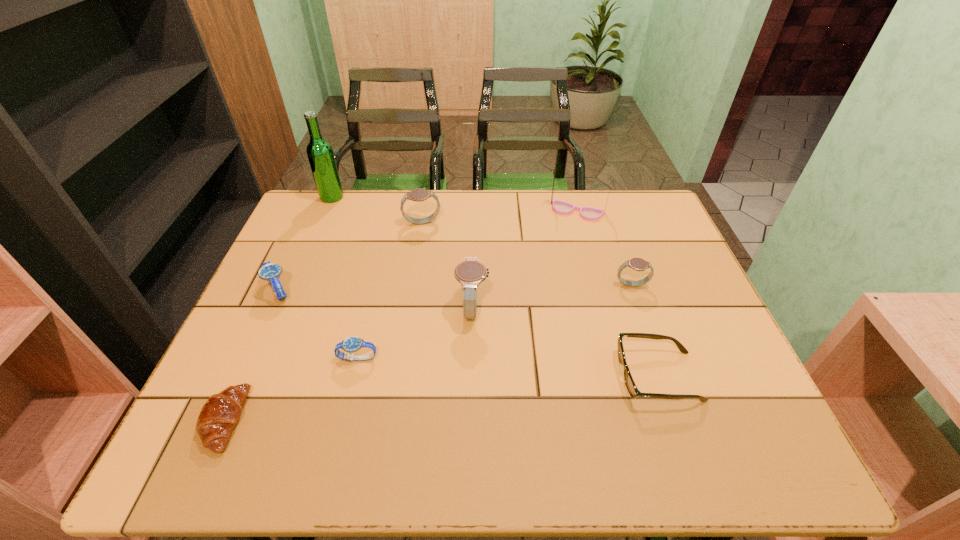
Where is `object that is positioned at the near edge`? object that is positioned at the near edge is located at coordinates (219, 415).

What are the coordinates of `beer bottle that is at the left edge` in the screenshot? It's located at (320, 154).

Where is `watch located in the left edge section of the desktop`? watch located in the left edge section of the desktop is located at coordinates (271, 272).

The height and width of the screenshot is (540, 960). What are the coordinates of `crescent roll located at the left edge` in the screenshot? It's located at (219, 415).

Identify the location of watch situated at the right edge. (638, 264).

You are a GUI agent. You are given a task and a screenshot of the screen. Output one action in this format:
    pyautogui.click(x=<x>, y=<y>)
    Task: Click on the spectacles present at the right edge
    
    Given the screenshot: What is the action you would take?
    pyautogui.click(x=630, y=384)

You are a GUI agent. You are given a task and a screenshot of the screen. Output one action in this format:
    pyautogui.click(x=<x>, y=<y>)
    Task: Click on the object located in the far left corner section of the desktop
    The height and width of the screenshot is (540, 960).
    Given the screenshot: What is the action you would take?
    320,154

Find the location of a particular element. This screenshot has width=960, height=540. object that is at the near left corner is located at coordinates (219, 415).

In order to click on blank space at the far edge in this screenshot , I will do `click(440, 190)`.

This screenshot has width=960, height=540. In order to click on blank area at the near edge in this screenshot , I will do `click(664, 464)`.